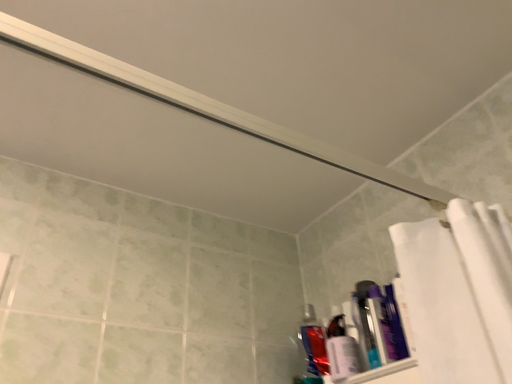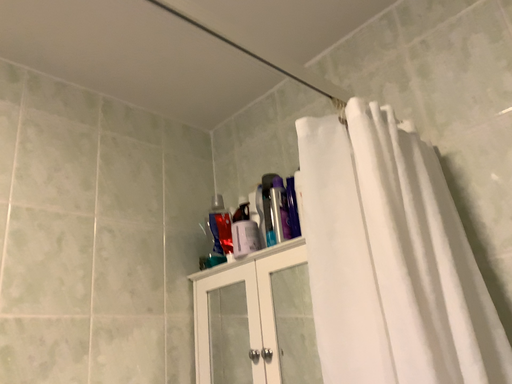
Question: How did the camera likely rotate when shooting the video?

Choices:
 (A) rotated left
 (B) rotated right

Answer: (B)